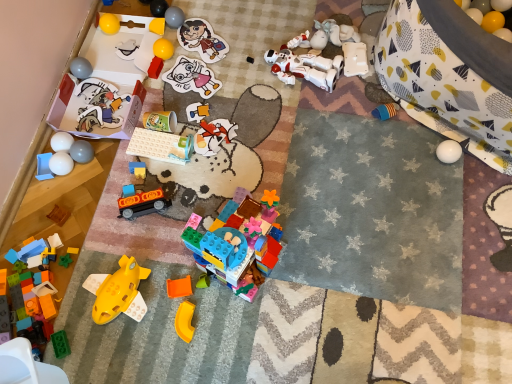
Question: From a real-world perspective, is yellow matte plastic toy at lower center, which ranks as the sixth toy in right-to-left order, located beneath black plastic toy at center, which is the 23th toy from left to right?

Choices:
 (A) no
 (B) yes

Answer: (A)

Question: Is the surface of yellow matte plastic toy at lower center, which appears as the 21th toy when viewed from the left, in direct contact with black plastic toy at center, which is the 23th toy from left to right?

Choices:
 (A) yes
 (B) no

Answer: (B)

Question: Is yellow matte plastic toy at lower center, which ranks as the sixth toy in right-to-left order, thinner than black plastic toy at center, which is the 23th toy from left to right?

Choices:
 (A) no
 (B) yes

Answer: (A)

Question: Can you confirm if yellow matte plastic toy at lower center, which appears as the 21th toy when viewed from the left, is positioned to the left of black plastic toy at center, the 4th toy in the right-to-left sequence?

Choices:
 (A) yes
 (B) no

Answer: (A)

Question: Can you confirm if yellow matte plastic toy at lower center, which ranks as the sixth toy in right-to-left order, is taller than black plastic toy at center, the 4th toy in the right-to-left sequence?

Choices:
 (A) yes
 (B) no

Answer: (A)

Question: From the image's perspective, is green plastic blocks at lower left, the 21th toy when ordered from right to left, positioned above or below matte paper sticker at center, the ninth toy from the right?

Choices:
 (A) below
 (B) above

Answer: (A)

Question: In the image, is green plastic blocks at lower left, the 21th toy when ordered from right to left, on the left side or the right side of matte paper sticker at center, the eighteenth toy in the left-to-right sequence?

Choices:
 (A) right
 (B) left

Answer: (B)

Question: In terms of size, does green plastic blocks at lower left, the 21th toy when ordered from right to left, appear bigger or smaller than matte paper sticker at center, the eighteenth toy in the left-to-right sequence?

Choices:
 (A) big
 (B) small

Answer: (B)

Question: Would you say green plastic blocks at lower left, the 21th toy when ordered from right to left, is inside or outside matte paper sticker at center, the ninth toy from the right?

Choices:
 (A) inside
 (B) outside

Answer: (B)

Question: From a real-world perspective, relative to matte gray ball at lower left, marked as the 20th toy in a right-to-left arrangement, is black plastic toy at center, which is the 23th toy from left to right, vertically above or below?

Choices:
 (A) below
 (B) above

Answer: (A)

Question: Considering the positions of black plastic toy at center, which is the 23th toy from left to right, and matte gray ball at lower left, marked as the 20th toy in a right-to-left arrangement, in the image, is black plastic toy at center, which is the 23th toy from left to right, wider or thinner than matte gray ball at lower left, marked as the 20th toy in a right-to-left arrangement,?

Choices:
 (A) thin
 (B) wide

Answer: (A)

Question: Considering the positions of point (252, 61) and point (75, 142), is point (252, 61) closer or farther from the camera than point (75, 142)?

Choices:
 (A) farther
 (B) closer

Answer: (A)

Question: In terms of size, does black plastic toy at center, which is the 23th toy from left to right, appear bigger or smaller than matte gray ball at lower left, which is counted as the seventh toy, starting from the left?

Choices:
 (A) small
 (B) big

Answer: (A)

Question: From the image's perspective, is yellow rubber ball at upper right, which ranks as the 26th toy in left-to-right order, positioned above or below blue plastic tray at lower left, the first toy in the left-to-right sequence?

Choices:
 (A) below
 (B) above

Answer: (B)

Question: Does point (494, 16) appear closer or farther from the camera than point (38, 160)?

Choices:
 (A) farther
 (B) closer

Answer: (A)